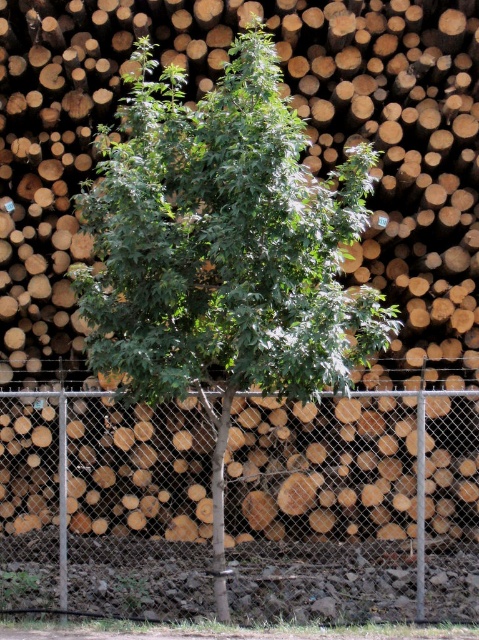
Question: Can you confirm if metal chain-link fence at center is smaller than green leafy tree at center?

Choices:
 (A) no
 (B) yes

Answer: (A)

Question: Can you confirm if metal chain-link fence at center is positioned to the left of green matte tree trunk at center?

Choices:
 (A) no
 (B) yes

Answer: (A)

Question: Does metal chain-link fence at center appear on the left side of green matte tree trunk at center?

Choices:
 (A) yes
 (B) no

Answer: (B)

Question: Among these objects, which one is nearest to the camera?

Choices:
 (A) green matte tree trunk at center
 (B) green leafy tree at center

Answer: (B)

Question: Which of the following is the farthest from the observer?

Choices:
 (A) green matte tree trunk at center
 (B) green leafy tree at center

Answer: (A)

Question: Which object is closer to the camera taking this photo?

Choices:
 (A) green matte tree trunk at center
 (B) metal chain-link fence at center

Answer: (A)